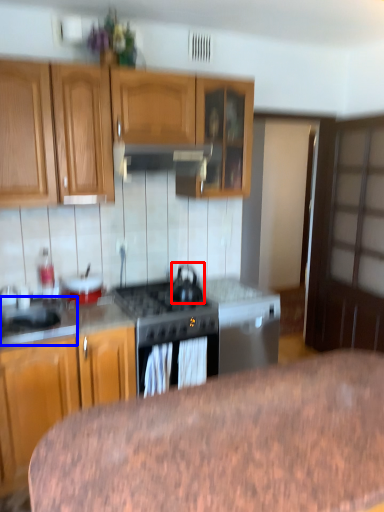
Question: Which point is closer to the camera, kitchen appliance (highlighted by a red box) or sink (highlighted by a blue box)?

Choices:
 (A) kitchen appliance
 (B) sink

Answer: (B)